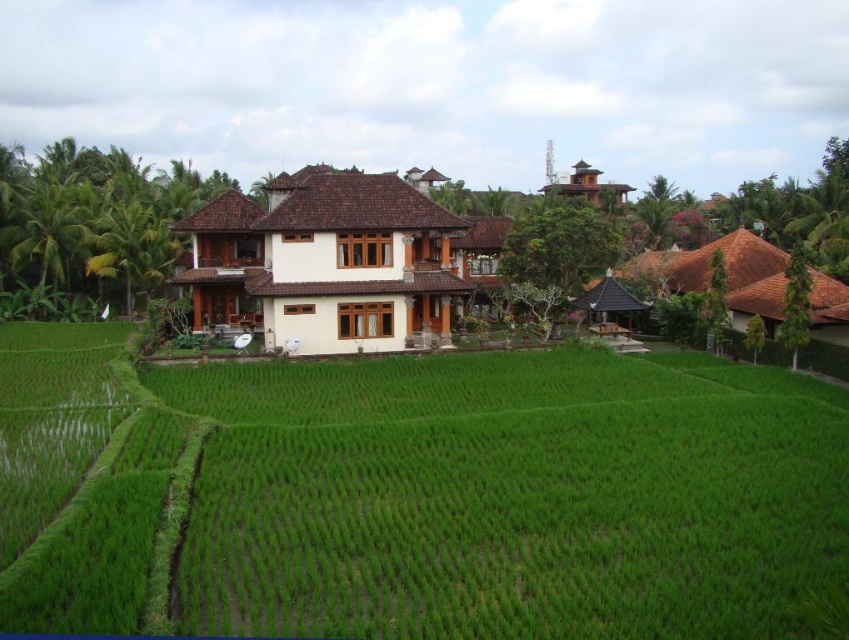
The image size is (849, 640). In order to click on green grassy rice field at center in this screenshot , I will do `click(413, 493)`.

Who is more forward, (313, 490) or (566, 193)?

Point (313, 490) is in front.

Between point (776, 506) and point (622, 198), which one is positioned behind?

The point (622, 198) is behind.

Identify the location of green grassy rice field at center. coord(413,493).

Does wooden house at center have a lesser height compared to brown wooden hut at upper right?

Correct, wooden house at center is not as tall as brown wooden hut at upper right.

Measure the distance between point (251, 257) and camera.

A distance of 164.41 feet exists between point (251, 257) and camera.

Find the location of a particular element. The image size is (849, 640). wooden house at center is located at coordinates (221, 260).

Between point (802, 442) and point (254, 296), which one is positioned in front?

Positioned in front is point (802, 442).

Is green grassy rice field at center smaller than white wood house at center?

Yes.

Does point (409, 369) lie behind point (271, 259)?

No, it is not.

At what (x,y) coordinates should I click in order to perform the action: click on green grassy rice field at center. Please return your answer as a coordinate pair (x, y). Looking at the image, I should click on (413, 493).